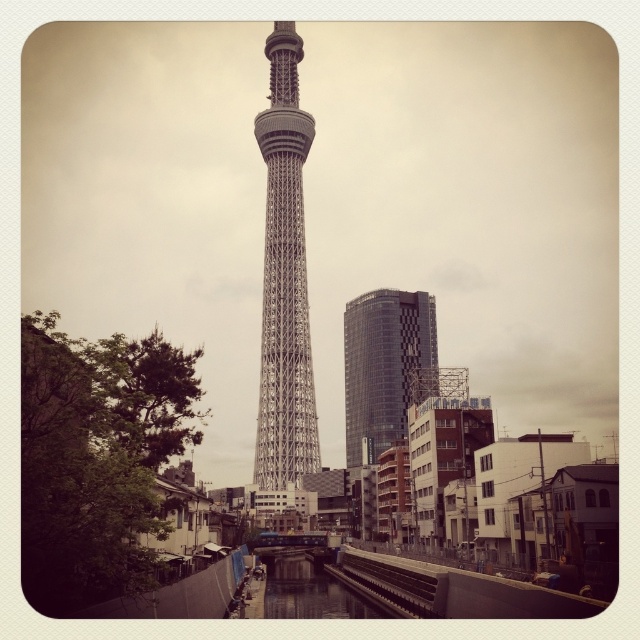
You are a drone operator planning to fly a drone between the silver metallic tower at center and the glassy reflective skyscraper at center. The drone has a maximum flight distance of 130 feet. Can the drone safely fly between them without exceeding its range?

The silver metallic tower at center and the glassy reflective skyscraper at center are 132.99 feet apart from each other. Since the drone can only fly up to 130 feet, it cannot safely fly between them without exceeding its range.

You are standing on the bank of the canal in front of the silver metallic tower at center. You want to take a photo of the tower with your smartphone, which has a maximum zoom range of 100 meters. Can you capture the entire tower in your photo without moving closer?

The silver metallic tower at center is 180.50 meters away from the viewer. Since your smartphone has a maximum zoom range of 100 meters, you cannot capture the entire tower in your photo without moving closer.

You are a tourist in Tokyo and want to take a photo of the silver metallic tower at center. You see a point marked at coordinates (284, 278). Where should you position yourself to ensure the tower is centered in your photo?

You should position yourself directly in front of the point marked at (284, 278), as that is where the silver metallic tower at center is located.